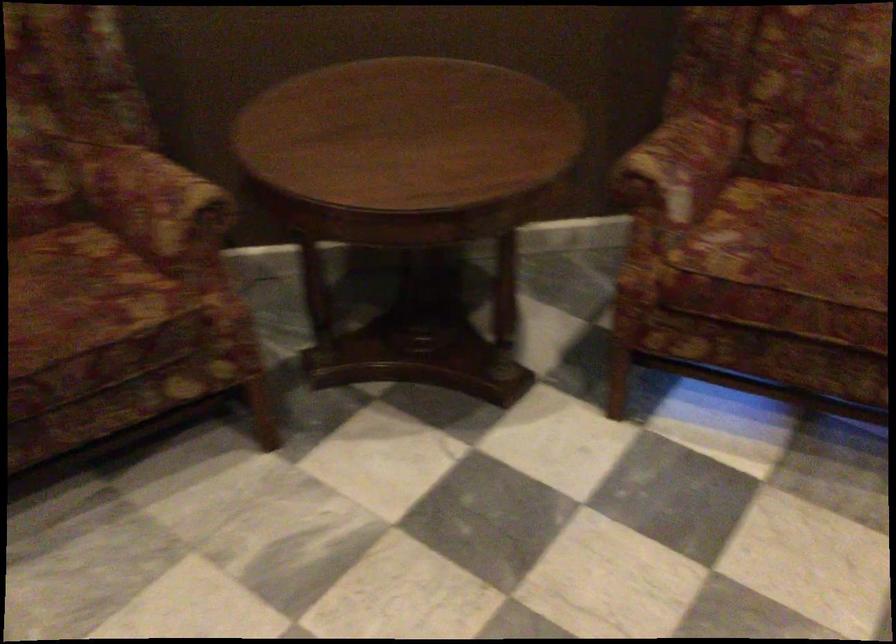
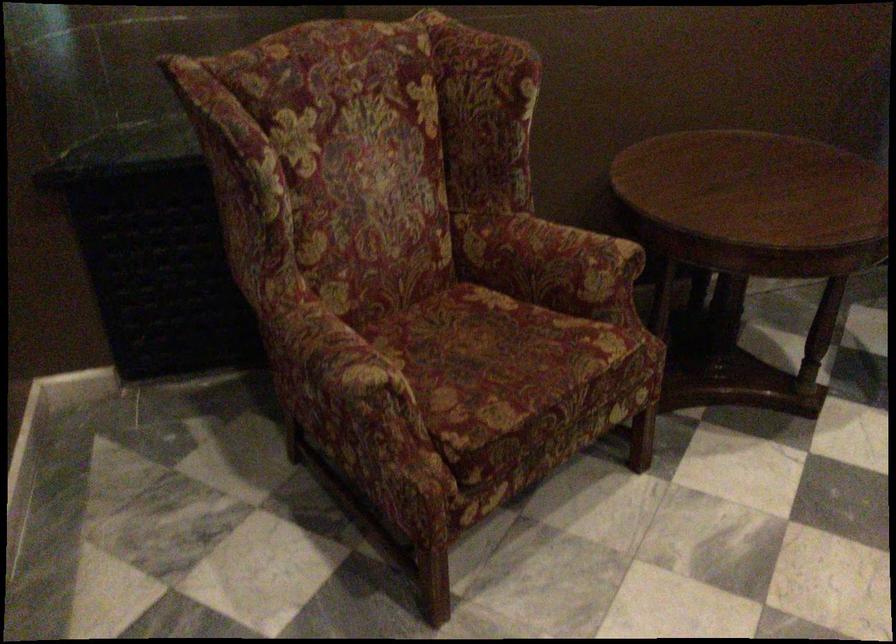
Where in the second image is the point corresponding to the point at 154,203 from the first image?

(572, 256)